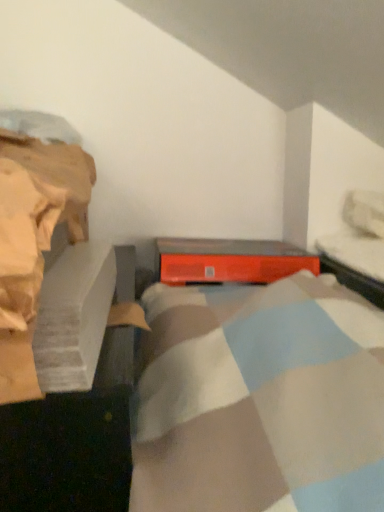
Question: Based on their positions, is orange matte speaker at center located to the left or right of metallic gray bed frame at upper right?

Choices:
 (A) left
 (B) right

Answer: (A)

Question: Is orange matte speaker at center inside the boundaries of metallic gray bed frame at upper right, or outside?

Choices:
 (A) outside
 (B) inside

Answer: (A)

Question: Considering the positions of orange matte speaker at center and metallic gray bed frame at upper right in the image, is orange matte speaker at center taller or shorter than metallic gray bed frame at upper right?

Choices:
 (A) short
 (B) tall

Answer: (B)

Question: In the image, is metallic gray bed frame at upper right positioned in front of or behind orange matte speaker at center?

Choices:
 (A) front
 (B) behind

Answer: (A)

Question: Is metallic gray bed frame at upper right situated inside orange matte speaker at center or outside?

Choices:
 (A) outside
 (B) inside

Answer: (A)

Question: From a real-world perspective, is metallic gray bed frame at upper right positioned above or below orange matte speaker at center?

Choices:
 (A) above
 (B) below

Answer: (A)

Question: Based on their sizes in the image, would you say metallic gray bed frame at upper right is bigger or smaller than orange matte speaker at center?

Choices:
 (A) big
 (B) small

Answer: (A)